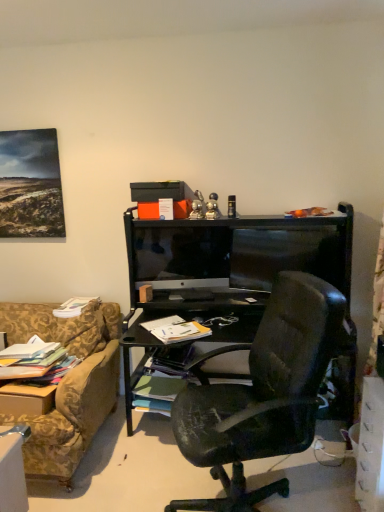
Question: Is multicolored paper stack at left, which is the 4th book from right to left, located outside green matte book at center, which ranks as the 2th book in right-to-left order?

Choices:
 (A) no
 (B) yes

Answer: (B)

Question: Would you say green matte book at center, which ranks as the 2th book in right-to-left order, is part of multicolored paper stack at left, acting as the 2th book starting from the bottom,'s contents?

Choices:
 (A) yes
 (B) no

Answer: (B)

Question: Is multicolored paper stack at left, marked as the first book in a left-to-right arrangement, closer to the viewer compared to green matte book at center, which ranks as the 2th book in right-to-left order?

Choices:
 (A) yes
 (B) no

Answer: (A)

Question: Does multicolored paper stack at left, which is the 4th book from right to left, have a greater height compared to green matte book at center, acting as the 1th book starting from the bottom?

Choices:
 (A) no
 (B) yes

Answer: (A)

Question: Is multicolored paper stack at left, marked as the first book in a left-to-right arrangement, oriented away from green matte book at center, which ranks as the 2th book in right-to-left order?

Choices:
 (A) no
 (B) yes

Answer: (A)

Question: Considering the positions of matte black box at upper center and white plastic drawer at lower right in the image, is matte black box at upper center wider or thinner than white plastic drawer at lower right?

Choices:
 (A) wide
 (B) thin

Answer: (A)

Question: Considering the positions of matte black box at upper center and white plastic drawer at lower right in the image, is matte black box at upper center bigger or smaller than white plastic drawer at lower right?

Choices:
 (A) small
 (B) big

Answer: (A)

Question: Is matte black box at upper center taller or shorter than white plastic drawer at lower right?

Choices:
 (A) tall
 (B) short

Answer: (B)

Question: Does point (190, 196) appear closer or farther from the camera than point (372, 430)?

Choices:
 (A) farther
 (B) closer

Answer: (A)

Question: Based on their sizes in the image, would you say black glossy monitor at center is bigger or smaller than matte black box at upper center?

Choices:
 (A) big
 (B) small

Answer: (A)

Question: Choose the correct answer: Is black glossy monitor at center inside matte black box at upper center or outside it?

Choices:
 (A) outside
 (B) inside

Answer: (A)

Question: Does point (140, 242) appear closer or farther from the camera than point (175, 188)?

Choices:
 (A) closer
 (B) farther

Answer: (B)

Question: From a real-world perspective, relative to matte black box at upper center, is black glossy monitor at center vertically above or below?

Choices:
 (A) above
 (B) below

Answer: (B)

Question: In the image, is green matte book at center, which appears as the third book when viewed from the left, positioned in front of or behind white paper at center, which is counted as the 2th book, starting from the top?

Choices:
 (A) behind
 (B) front

Answer: (A)

Question: From their relative heights in the image, would you say green matte book at center, which appears as the 4th book when viewed from the top, is taller or shorter than white paper at center, the 3th book positioned from the bottom?

Choices:
 (A) short
 (B) tall

Answer: (B)